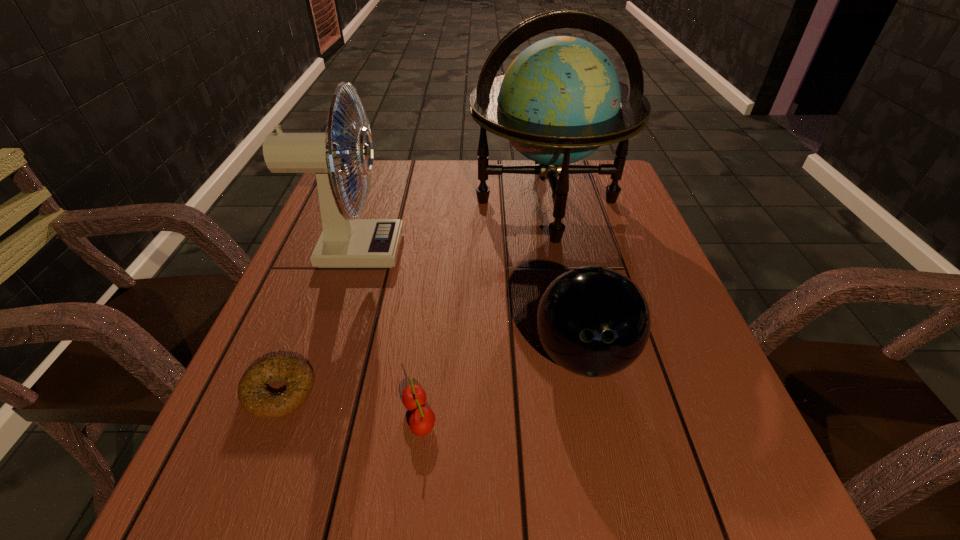
This screenshot has width=960, height=540. What are the coordinates of `vacant space at the right edge of the desktop` in the screenshot? It's located at (659, 291).

In the image, there is a desktop. At what (x,y) coordinates should I click in order to perform the action: click on blank space at the far right corner. Please return your answer as a coordinate pair (x, y). The width and height of the screenshot is (960, 540). Looking at the image, I should click on (623, 175).

Identify the location of vacant space at the near right corner. The image size is (960, 540). (762, 470).

Where is `free space between the third object from left to right and the bowling ball`? The height and width of the screenshot is (540, 960). free space between the third object from left to right and the bowling ball is located at coordinates (501, 386).

The image size is (960, 540). I want to click on free spot between the globe and the third object from right to left, so click(x=483, y=309).

Identify the location of vacant point located between the fan and the third object from left to right. (386, 334).

Where is `vacant area that lies between the second shortest object and the tallest object`? The height and width of the screenshot is (540, 960). vacant area that lies between the second shortest object and the tallest object is located at coordinates (x=483, y=309).

Locate an element on the screen. free space between the bagel and the fourth tallest object is located at coordinates (349, 404).

Where is `vacant area that lies between the cherry and the fan`? The height and width of the screenshot is (540, 960). vacant area that lies between the cherry and the fan is located at coordinates (386, 334).

The image size is (960, 540). Find the location of `free spot between the bowling ball and the bagel`. free spot between the bowling ball and the bagel is located at coordinates (431, 374).